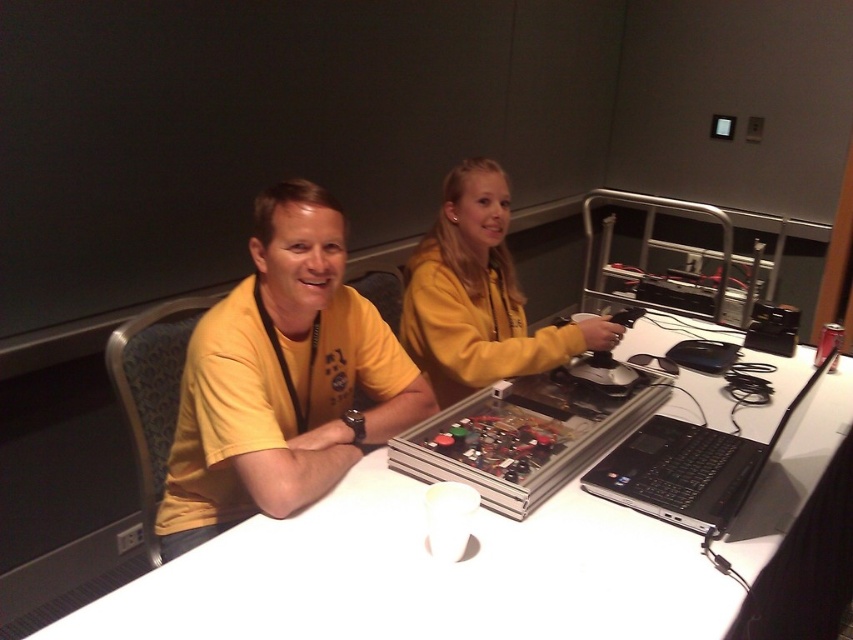
Which is in front, point (451, 604) or point (595, 468)?

Point (451, 604) is in front.

Who is positioned more to the right, white glossy table at center or black matte laptop at lower right?

black matte laptop at lower right

Who is more distant from viewer, (579,563) or (705,467)?

Point (705,467)

Locate an element on the screen. Image resolution: width=853 pixels, height=640 pixels. white glossy table at center is located at coordinates click(422, 577).

In the scene shown: Which is below, matte yellow shirt at center or yellow fleece at center?

matte yellow shirt at center is lower down.

Which of these two, matte yellow shirt at center or yellow fleece at center, stands shorter?

yellow fleece at center is shorter.

Image resolution: width=853 pixels, height=640 pixels. In order to click on matte yellow shirt at center in this screenshot , I will do `click(282, 380)`.

Between matte yellow shirt at center and black matte laptop at lower right, which one appears on the right side from the viewer's perspective?

black matte laptop at lower right

Can you confirm if matte yellow shirt at center is smaller than black matte laptop at lower right?

No, matte yellow shirt at center is not smaller than black matte laptop at lower right.

Between point (190, 339) and point (788, 420), which one is positioned in front?

Positioned in front is point (788, 420).

The height and width of the screenshot is (640, 853). In order to click on matte yellow shirt at center in this screenshot , I will do `click(282, 380)`.